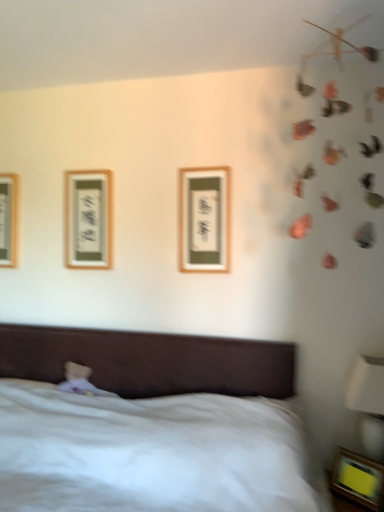
What do you see at coordinates (358, 478) in the screenshot? Image resolution: width=384 pixels, height=512 pixels. I see `wooden picture frame at lower right, which ranks as the 4th picture frame in left-to-right order` at bounding box center [358, 478].

Locate an element on the screen. This screenshot has width=384, height=512. wooden framed picture at center, which appears as the second picture frame when ordered from the bottom is located at coordinates (204, 219).

What is the approximate height of matte wood picture frame at upper left, the second picture frame from the top?

20.83 inches.

The image size is (384, 512). What do you see at coordinates (152, 426) in the screenshot?
I see `brown fabric bed at lower left` at bounding box center [152, 426].

This screenshot has width=384, height=512. Find the location of `white glossy bedside lamp at lower right`. white glossy bedside lamp at lower right is located at coordinates (368, 402).

Locate an element on the screen. picture frame that is the 2nd object to the right of the brown fabric bed at lower left, starting at the anchor is located at coordinates [x=358, y=478].

Considering the points (350, 474) and (42, 452), which point is in front, point (350, 474) or point (42, 452)?

The point (350, 474) is more forward.

Which object is thinner, wooden picture frame at lower right, which is counted as the 1th picture frame, starting from the front, or brown fabric bed at lower left?

With smaller width is wooden picture frame at lower right, which is counted as the 1th picture frame, starting from the front.

From a real-world perspective, is wooden picture frame at lower right, which ranks as the 4th picture frame in left-to-right order, under brown fabric bed at lower left?

Yes, from a real-world perspective, wooden picture frame at lower right, which ranks as the 4th picture frame in left-to-right order, is under brown fabric bed at lower left.

Who is shorter, white glossy bedside lamp at lower right or wooden framed picture at left, the first picture frame in the top-to-bottom sequence?

Standing shorter between the two is wooden framed picture at left, the first picture frame in the top-to-bottom sequence.

From the image's perspective, is white glossy bedside lamp at lower right below wooden framed picture at left, which appears as the 1th picture frame when viewed from the left?

Yes, from the image's perspective, white glossy bedside lamp at lower right is below wooden framed picture at left, which appears as the 1th picture frame when viewed from the left.

Considering the sizes of objects white glossy bedside lamp at lower right and wooden framed picture at left, the first picture frame in the top-to-bottom sequence, in the image provided, who is smaller, white glossy bedside lamp at lower right or wooden framed picture at left, the first picture frame in the top-to-bottom sequence,?

With smaller size is wooden framed picture at left, the first picture frame in the top-to-bottom sequence.

What's the angular difference between wooden framed picture at center, which appears as the second picture frame when ordered from the bottom, and white plush bear at lower left's facing directions?

There is a 0.00195-degree angle between the facing directions of wooden framed picture at center, which appears as the second picture frame when ordered from the bottom, and white plush bear at lower left.

From a real-world perspective, count 1st picture frames upward from the white plush bear at lower left and point to it. Please provide its 2D coordinates.

[(204, 219)]

Is wooden framed picture at center, which is the second picture frame in right-to-left order, taller or shorter than white plush bear at lower left?

In the image, wooden framed picture at center, which is the second picture frame in right-to-left order, appears to be taller than white plush bear at lower left.

From a real-world perspective, does wooden framed picture at center, which is counted as the second picture frame, starting from the front, sit lower than white plush bear at lower left?

No, from a real-world perspective, wooden framed picture at center, which is counted as the second picture frame, starting from the front, is not beneath white plush bear at lower left.

Is the position of white glossy bedside lamp at lower right less distant than that of wooden picture frame at lower right, which ranks as the 4th picture frame in left-to-right order?

No.

From a real-world perspective, who is located higher, white glossy bedside lamp at lower right or wooden picture frame at lower right, marked as the 4th picture frame in a top-to-bottom arrangement?

white glossy bedside lamp at lower right, from a real-world perspective.

From the image's perspective, which is above, white glossy bedside lamp at lower right or wooden picture frame at lower right, which is counted as the 1th picture frame, starting from the front?

white glossy bedside lamp at lower right.

The width and height of the screenshot is (384, 512). Find the location of `picture frame in front of the white glossy bedside lamp at lower right`. picture frame in front of the white glossy bedside lamp at lower right is located at coordinates (358, 478).

Where is `the 3rd picture frame to the left when counting from the white glossy bedside lamp at lower right`? The width and height of the screenshot is (384, 512). the 3rd picture frame to the left when counting from the white glossy bedside lamp at lower right is located at coordinates (88, 219).

Does matte wood picture frame at upper left, placed as the third picture frame when sorted from bottom to top, come behind white glossy bedside lamp at lower right?

Yes, it is behind white glossy bedside lamp at lower right.

In the scene shown: From a real-world perspective, relative to white glossy bedside lamp at lower right, is matte wood picture frame at upper left, placed as the third picture frame when sorted from bottom to top, vertically above or below?

In terms of real-world spatial position, matte wood picture frame at upper left, placed as the third picture frame when sorted from bottom to top, is above white glossy bedside lamp at lower right.

From the image's perspective, is matte wood picture frame at upper left, the 3th picture frame in the right-to-left sequence, under white glossy bedside lamp at lower right?

No.

Considering the sizes of objects matte wood picture frame at upper left, the 3th picture frame in the right-to-left sequence, and wooden framed picture at left, the 4th picture frame in the front-to-back sequence, in the image provided, who is thinner, matte wood picture frame at upper left, the 3th picture frame in the right-to-left sequence, or wooden framed picture at left, the 4th picture frame in the front-to-back sequence,?

With smaller width is matte wood picture frame at upper left, the 3th picture frame in the right-to-left sequence.

Are matte wood picture frame at upper left, which is counted as the second picture frame, starting from the left, and wooden framed picture at left, the 4th picture frame in the front-to-back sequence, located far from each other?

That's not correct — matte wood picture frame at upper left, which is counted as the second picture frame, starting from the left, is a little close to wooden framed picture at left, the 4th picture frame in the front-to-back sequence.

Consider the image. Considering the relative positions of matte wood picture frame at upper left, the 3th picture frame in the right-to-left sequence, and wooden framed picture at left, which is the first picture frame in back-to-front order, in the image provided, is matte wood picture frame at upper left, the 3th picture frame in the right-to-left sequence, in front of wooden framed picture at left, which is the first picture frame in back-to-front order,?

Yes.

Could you tell me if matte wood picture frame at upper left, the 3th picture frame in the right-to-left sequence, is facing wooden framed picture at left, the first picture frame in the top-to-bottom sequence?

No.

From a real-world perspective, which is physically below, white plush bear at lower left or wooden picture frame at lower right, arranged as the 4th picture frame when viewed from the back?

wooden picture frame at lower right, arranged as the 4th picture frame when viewed from the back, is physically lower.

Is white plush bear at lower left wider or thinner than wooden picture frame at lower right, which is counted as the 1th picture frame, starting from the front?

Clearly, white plush bear at lower left has more width compared to wooden picture frame at lower right, which is counted as the 1th picture frame, starting from the front.

How different are the orientations of white plush bear at lower left and wooden picture frame at lower right, which ranks as the 4th picture frame in left-to-right order, in degrees?

35.7 degrees.

Is point (82, 369) positioned behind point (353, 479)?

That is True.

Where is `picture frame below the brown fabric bed at lower left (from the image's perspective)`? The width and height of the screenshot is (384, 512). picture frame below the brown fabric bed at lower left (from the image's perspective) is located at coordinates (358, 478).

This screenshot has width=384, height=512. I want to click on bedside lamp located underneath the wooden framed picture at left, which appears as the 1th picture frame when viewed from the left (from a real-world perspective), so click(368, 402).

Estimate the real-world distances between objects in this image. Which object is further from white plush bear at lower left, brown fabric bed at lower left or wooden picture frame at lower right, which is counted as the 1th picture frame, starting from the front?

wooden picture frame at lower right, which is counted as the 1th picture frame, starting from the front, is further to white plush bear at lower left.

Estimate the real-world distances between objects in this image. Which object is closer to wooden framed picture at center, which is counted as the second picture frame, starting from the front, matte wood picture frame at upper left, which appears as the 3th picture frame when viewed from the front, or white glossy bedside lamp at lower right?

matte wood picture frame at upper left, which appears as the 3th picture frame when viewed from the front, is positioned closer to the anchor wooden framed picture at center, which is counted as the second picture frame, starting from the front.

Which object lies further to the anchor point matte wood picture frame at upper left, which is counted as the second picture frame, starting from the left, wooden framed picture at center, which is the second picture frame in right-to-left order, or wooden picture frame at lower right, which is counted as the 1th picture frame, starting from the front?

wooden picture frame at lower right, which is counted as the 1th picture frame, starting from the front, lies further to matte wood picture frame at upper left, which is counted as the second picture frame, starting from the left, than the other object.

Consider the image. Estimate the real-world distances between objects in this image. Which object is closer to matte wood picture frame at upper left, the second picture frame from the top, wooden framed picture at center, which is the second picture frame in right-to-left order, or wooden framed picture at left, marked as the fourth picture frame in a bottom-to-top arrangement?

wooden framed picture at left, marked as the fourth picture frame in a bottom-to-top arrangement.

When comparing their distances from matte wood picture frame at upper left, which is counted as the second picture frame, starting from the left, does white glossy bedside lamp at lower right or white plush bear at lower left seem further?

white glossy bedside lamp at lower right lies further to matte wood picture frame at upper left, which is counted as the second picture frame, starting from the left, than the other object.

Estimate the real-world distances between objects in this image. Which object is further from wooden picture frame at lower right, which is counted as the 1th picture frame, starting from the front, wooden framed picture at center, the 3th picture frame in the back-to-front sequence, or matte wood picture frame at upper left, which appears as the 3th picture frame when viewed from the front?

Based on the image, matte wood picture frame at upper left, which appears as the 3th picture frame when viewed from the front, appears to be further to wooden picture frame at lower right, which is counted as the 1th picture frame, starting from the front.

Estimate the real-world distances between objects in this image. Which object is closer to white glossy bedside lamp at lower right, wooden framed picture at center, the third picture frame positioned from the top, or wooden framed picture at left, the 4th picture frame positioned from the right?

Among the two, wooden framed picture at center, the third picture frame positioned from the top, is located nearer to white glossy bedside lamp at lower right.

Consider the image. Looking at the image, which one is located closer to brown fabric bed at lower left, matte wood picture frame at upper left, the second picture frame in the back-to-front sequence, or white plush bear at lower left?

The object closer to brown fabric bed at lower left is white plush bear at lower left.

The image size is (384, 512). What are the coordinates of `toy located between brown fabric bed at lower left and matte wood picture frame at upper left, which appears as the 3th picture frame when viewed from the front, in the depth direction` in the screenshot? It's located at (80, 381).

I want to click on toy between brown fabric bed at lower left and wooden framed picture at left, the 4th picture frame in the front-to-back sequence, from front to back, so click(x=80, y=381).

Where is `bedside lamp located between brown fabric bed at lower left and matte wood picture frame at upper left, the 3th picture frame in the right-to-left sequence, in the depth direction`? Image resolution: width=384 pixels, height=512 pixels. bedside lamp located between brown fabric bed at lower left and matte wood picture frame at upper left, the 3th picture frame in the right-to-left sequence, in the depth direction is located at coordinates (368, 402).

Find the location of a particular element. This screenshot has width=384, height=512. toy located between wooden framed picture at left, which is the first picture frame in back-to-front order, and wooden framed picture at center, which is counted as the second picture frame, starting from the front, in the left-right direction is located at coordinates (80, 381).